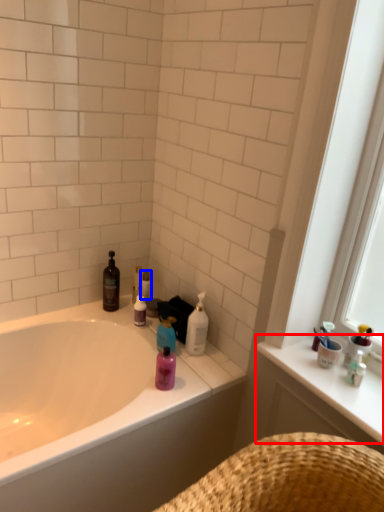
Question: Among these objects, which one is farthest to the camera, counter top (highlighted by a red box) or toilet paper (highlighted by a blue box)?

Choices:
 (A) counter top
 (B) toilet paper

Answer: (B)